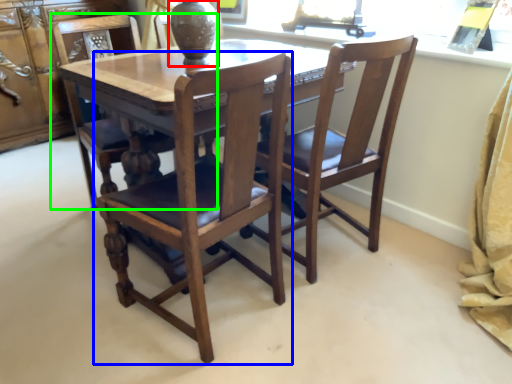
Question: Which is nearer to the glass vase (highlighted by a red box)? chair (highlighted by a blue box) or chair (highlighted by a green box).

Choices:
 (A) chair
 (B) chair

Answer: (B)